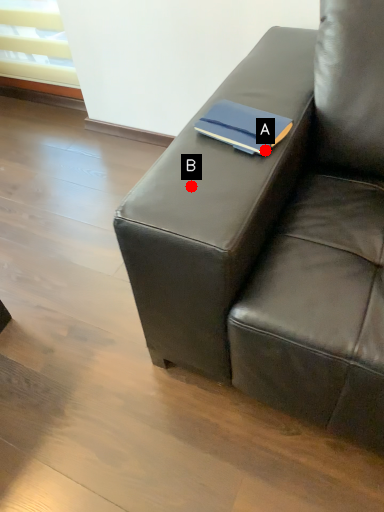
Question: Two points are circled on the image, labeled by A and B beside each circle. Which point is closer to the camera?

Choices:
 (A) A is closer
 (B) B is closer

Answer: (B)